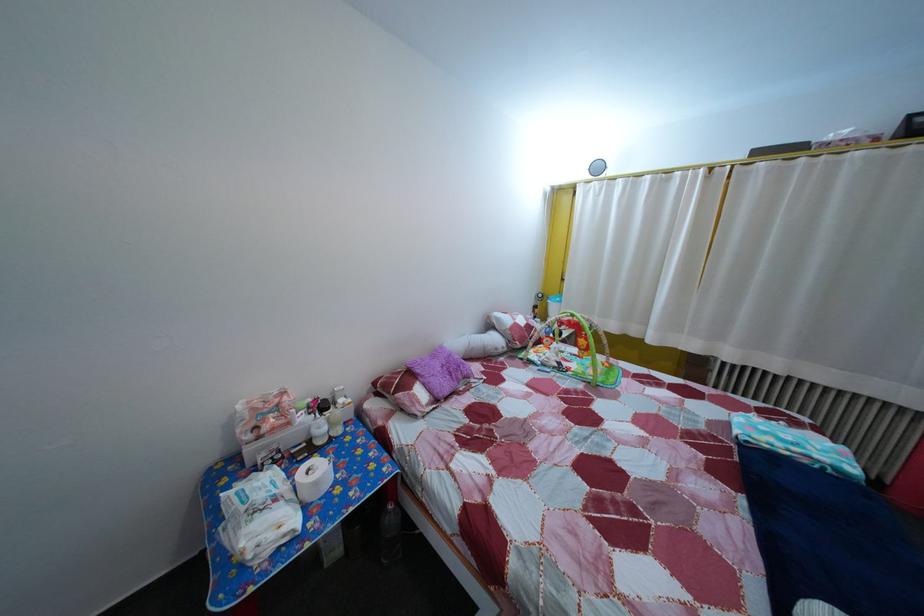
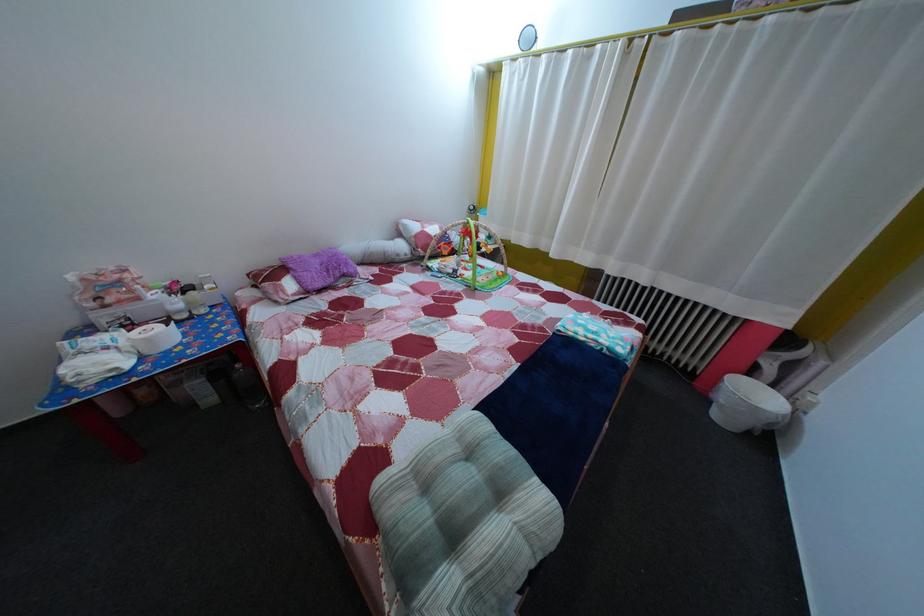
Question: The images are taken continuously from a first-person perspective. In which direction are you moving?

Choices:
 (A) Left
 (B) Right
 (C) Forward
 (D) Backward

Answer: (B)